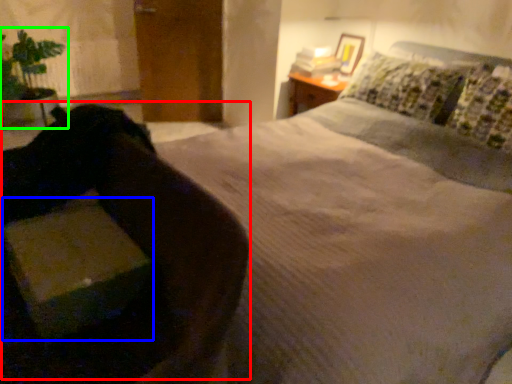
Question: Which is farther away from swivel chair (highlighted by a red box)? cardboard box (highlighted by a blue box) or houseplant (highlighted by a green box)?

Choices:
 (A) cardboard box
 (B) houseplant

Answer: (B)